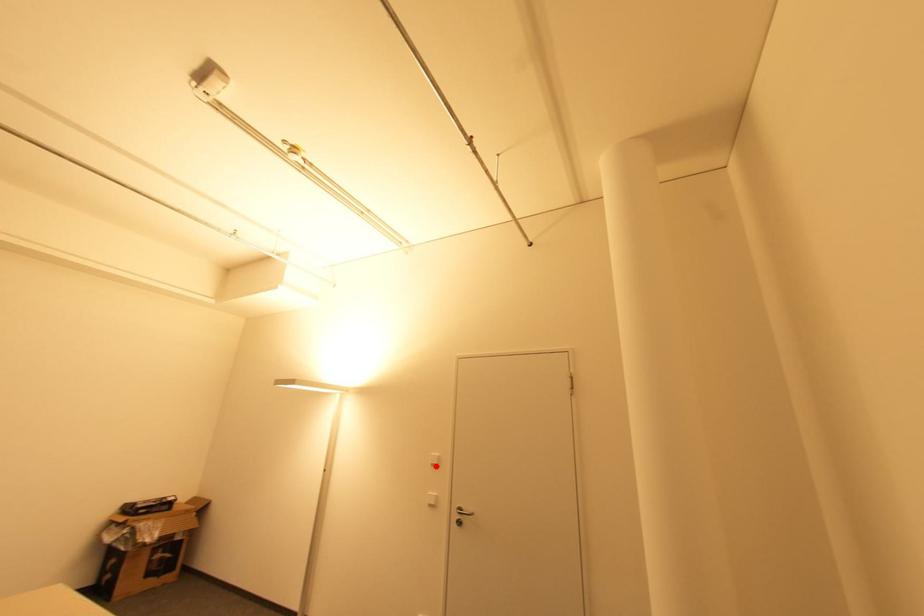
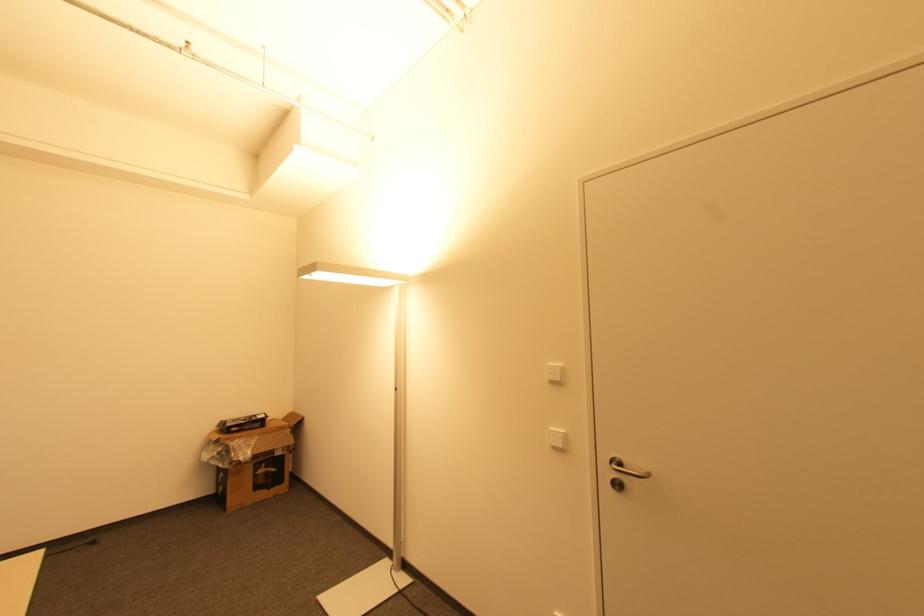
Find the pixel in the second image that matches the highlighted location in the first image.

(554, 383)